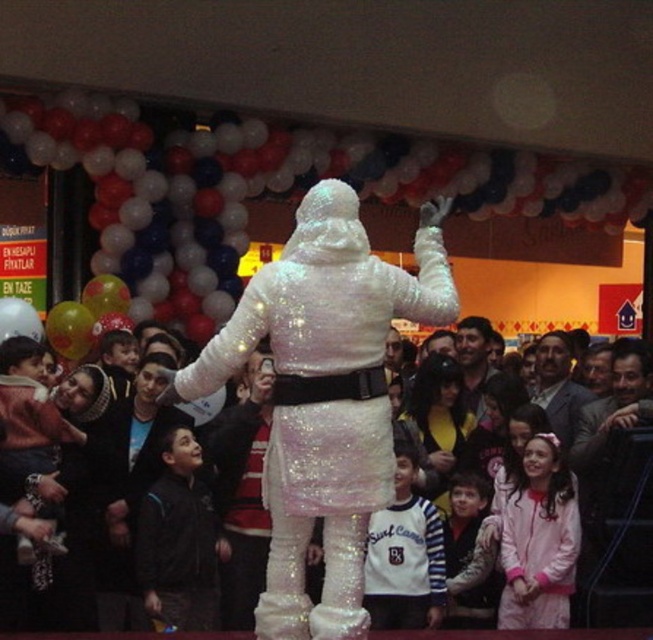
You are at a festive event and see the white sequined costume at center and the striped sweater at center. Which one is covering the other?

The white sequined costume at center is positioned over striped sweater at center, so it is covering the striped sweater at center.

In the scene shown: You are standing in the center of the room and want to reach the white glossy balloon at center. Which direction should you move to get closer to it?

Since the white glossy balloon at center is located at point coordinates of [289,186], you should move towards the direction of those coordinates to get closer to it.